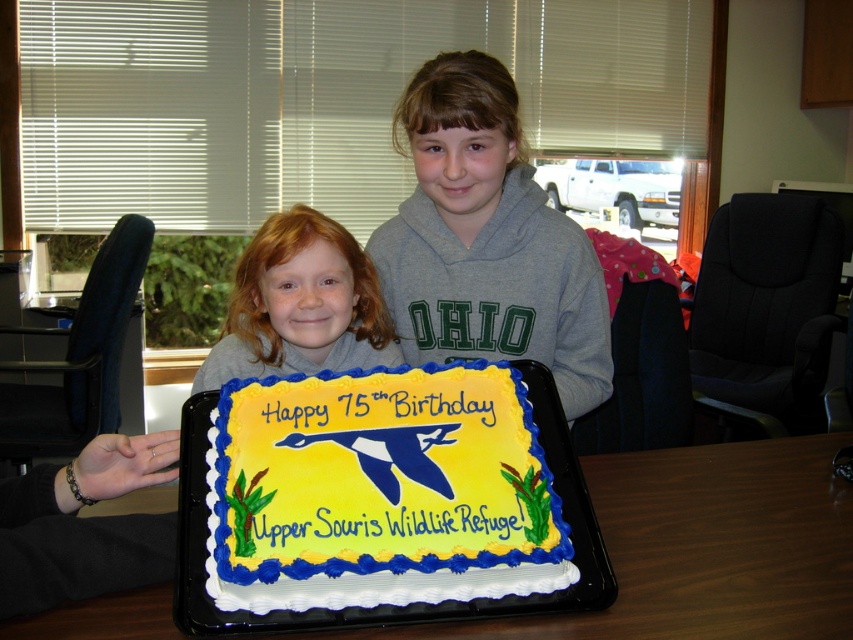
Which of these two, yellow fondant cake at center or white fondant cake at center, stands shorter?

white fondant cake at center is shorter.

Can you confirm if yellow fondant cake at center is positioned below white fondant cake at center?

No.

Between point (300, 392) and point (322, 586), which one is positioned in front?

Point (322, 586) is more forward.

You are a GUI agent. You are given a task and a screenshot of the screen. Output one action in this format:
    pyautogui.click(x=<x>, y=<y>)
    Task: Click on the yellow fondant cake at center
    Image resolution: width=853 pixels, height=640 pixels.
    Given the screenshot: What is the action you would take?
    pyautogui.click(x=381, y=492)

Can you confirm if gray fleece sweatshirt at center is positioned to the left of white fondant cake at center?

No, gray fleece sweatshirt at center is not to the left of white fondant cake at center.

Is gray fleece sweatshirt at center below white fondant cake at center?

Incorrect, gray fleece sweatshirt at center is not positioned below white fondant cake at center.

Where is `gray fleece sweatshirt at center`? This screenshot has height=640, width=853. gray fleece sweatshirt at center is located at coordinates (486, 240).

Is yellow fondant cake at center closer to the viewer compared to white plastic tray at lower center?

Yes, yellow fondant cake at center is in front of white plastic tray at lower center.

Is yellow fondant cake at center bigger than white plastic tray at lower center?

No.

Identify the location of yellow fondant cake at center. (381, 492).

Find the location of a particular element. yellow fondant cake at center is located at coordinates (381, 492).